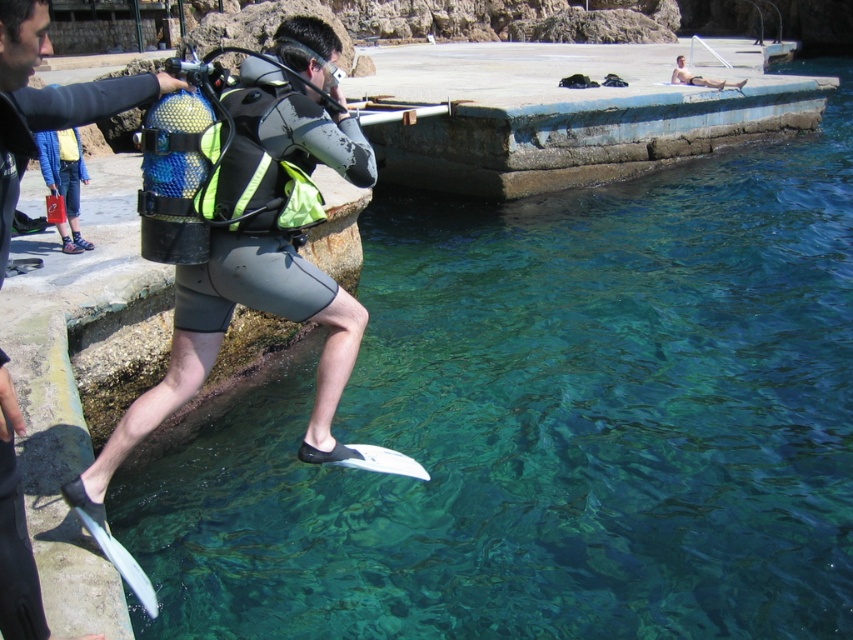
From the picture: You are a photographer positioned on the rocky shore. You need to capture a photo of both the matte black diving suit at center and the white plastic surfboard at lower center. Based on their sizes, which object should you focus on first to ensure both are in frame without zooming?

The matte black diving suit at center has a lesser width compared to the white plastic surfboard at lower center, so you should focus on the white plastic surfboard at lower center first since it is wider and will take up more space in the frame.

You are a scuba diver preparing to jump off a platform into the water. Your fins are positioned at a specific coordinate. Where exactly are your matte black fins at lower left located in relation to the platform?

The matte black fins at lower left are located at point coordinates of 0.156 on the x axis and 0.056 on the y axis.

You are standing on the concrete platform and see the matte black fins at lower left. If you want to reach them without moving your feet, can you do it?

The matte black fins at lower left are 22.30 feet away from the viewer, so you cannot reach them without moving your feet.